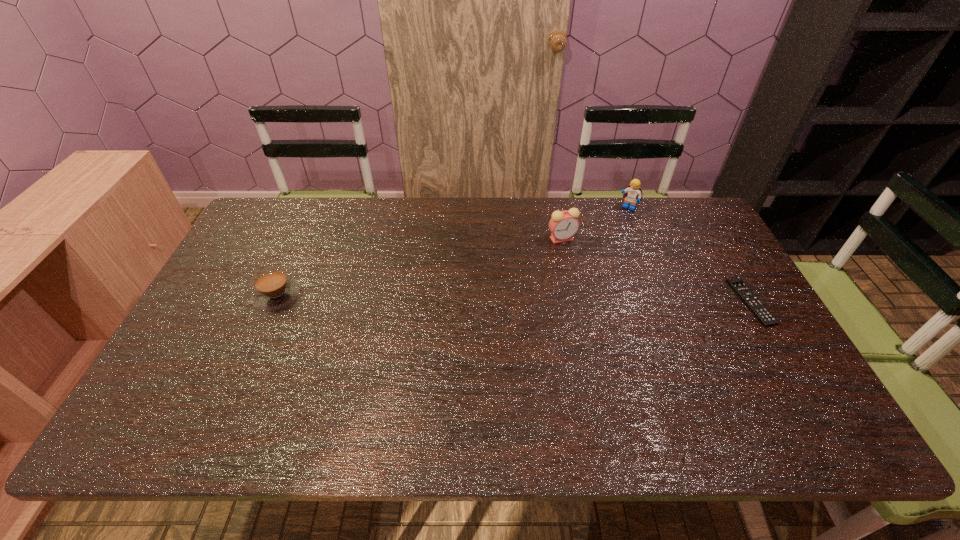
Locate an element on the screen. The width and height of the screenshot is (960, 540). vacant region that satisfies the following two spatial constraints: 1. on the back side of the second object from left to right; 2. on the left side of the farthest object is located at coordinates (556, 207).